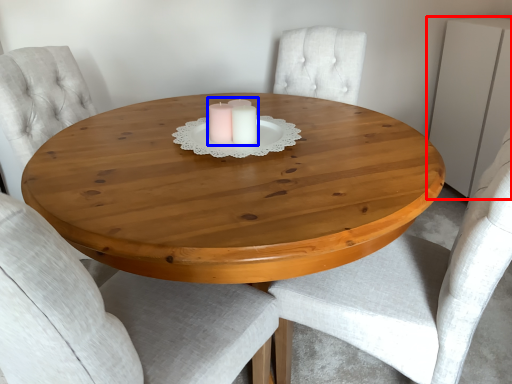
Question: Which object is closer to the camera taking this photo, dresser (highlighted by a red box) or candle holder (highlighted by a blue box)?

Choices:
 (A) dresser
 (B) candle holder

Answer: (B)